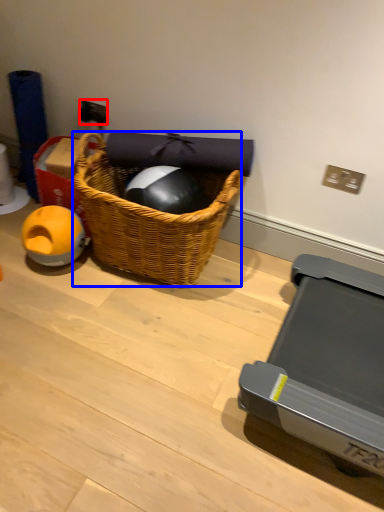
Question: Which object appears farthest to the camera in this image, power outlet (highlighted by a red box) or picnic basket (highlighted by a blue box)?

Choices:
 (A) power outlet
 (B) picnic basket

Answer: (A)